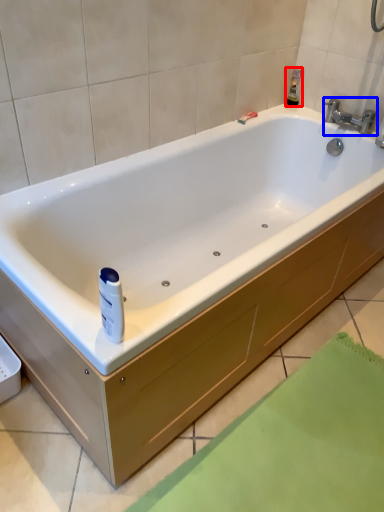
Question: Which object is further to the camera taking this photo, toiletry (highlighted by a red box) or tap (highlighted by a blue box)?

Choices:
 (A) toiletry
 (B) tap

Answer: (A)